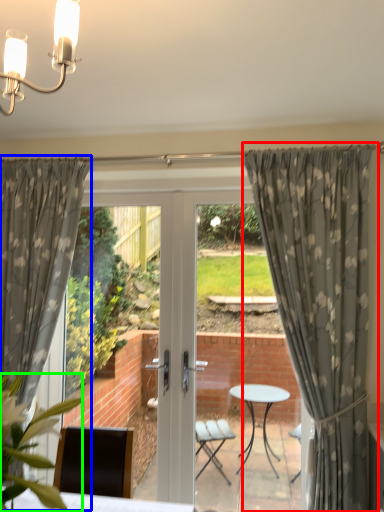
Question: Which object is the farthest from curtain (highlighted by a red box)? Choose among these: curtain (highlighted by a blue box) or plant (highlighted by a green box).

Choices:
 (A) curtain
 (B) plant

Answer: (B)